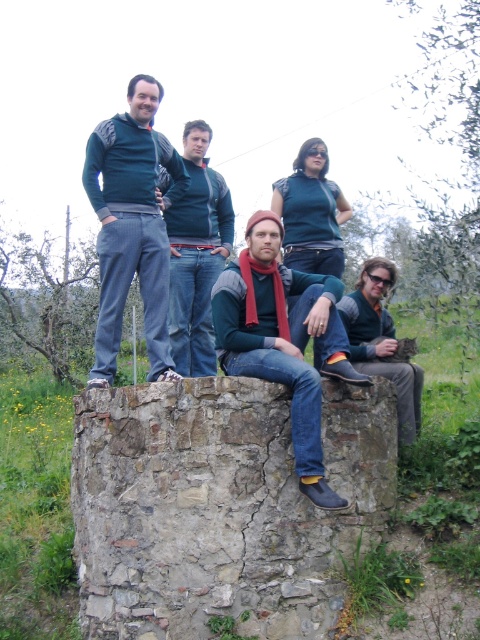
You are standing in front of the stone structure and want to determine the relative positions of two points marked on the structure. Which of the two points, point 1 at coordinates (249, 244) or point 2 at (162, 147), is closer to you?

Point 1 at coordinates (249, 244) is closer to you than point 2 at (162, 147).

You are a photographer trying to capture a group photo of the matte green sweater at upper left and the dark blue sweater at center. Since you want to ensure both subjects are in focus, you need to know which one is closer to the camera. Can you determine which person is closer based on their sweater colors?

The matte green sweater at upper left is taller than the dark blue sweater at center, which suggests that the person wearing the matte green sweater at upper left is closer to the camera. Therefore, to ensure both are in focus, adjust the camera settings accordingly.

You are a fashion designer observing the group. You need to determine which item of clothing is smaller in size between the knit wool scarf at center and the matte green sweater at upper left. Which one is smaller?

The knit wool scarf at center is smaller in size compared to the matte green sweater at upper left.